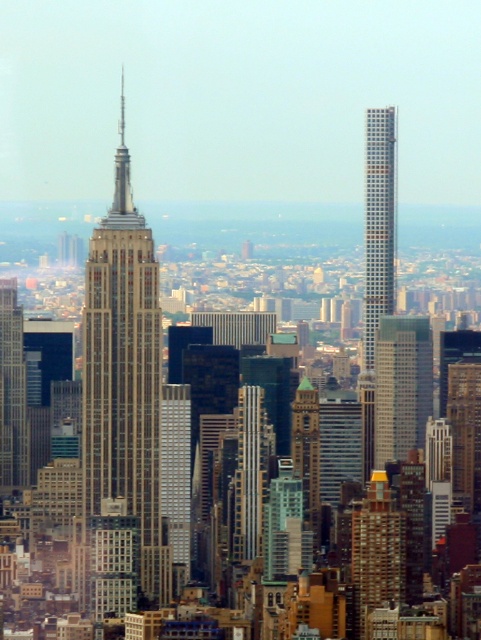
Question: Among these points, which one is nearest to the camera?

Choices:
 (A) (154, 522)
 (B) (387, 243)

Answer: (B)

Question: Observing the image, what is the correct spatial positioning of glassy reflective skyscraper at center in reference to brick textured building at center?

Choices:
 (A) left
 (B) right

Answer: (B)

Question: Estimate the real-world distances between objects in this image. Which object is closer to the silver metallic skyscraper at upper right?

Choices:
 (A) gray brick skyscraper at center
 (B) brick textured building at center
 (C) matte glass skyscraper at center-left

Answer: (B)

Question: Which point appears farthest from the camera in this image?

Choices:
 (A) (387, 252)
 (B) (363, 524)

Answer: (B)

Question: Observing the image, what is the correct spatial positioning of silver metallic skyscraper at upper right in reference to brick textured building at center?

Choices:
 (A) right
 (B) left

Answer: (B)

Question: Is gray brick skyscraper at center to the right of brick textured building at center from the viewer's perspective?

Choices:
 (A) no
 (B) yes

Answer: (A)